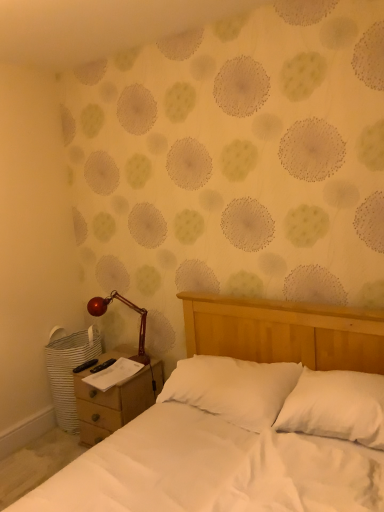
Find the location of a particular element. The height and width of the screenshot is (512, 384). empty space that is ontop of wooden nightstand at lower left (from a real-world perspective) is located at coordinates tap(108, 368).